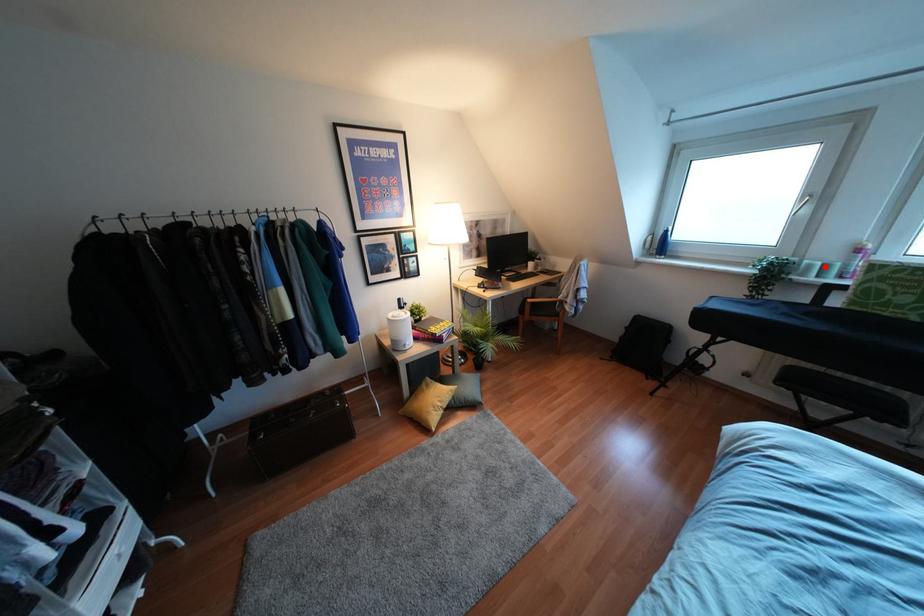
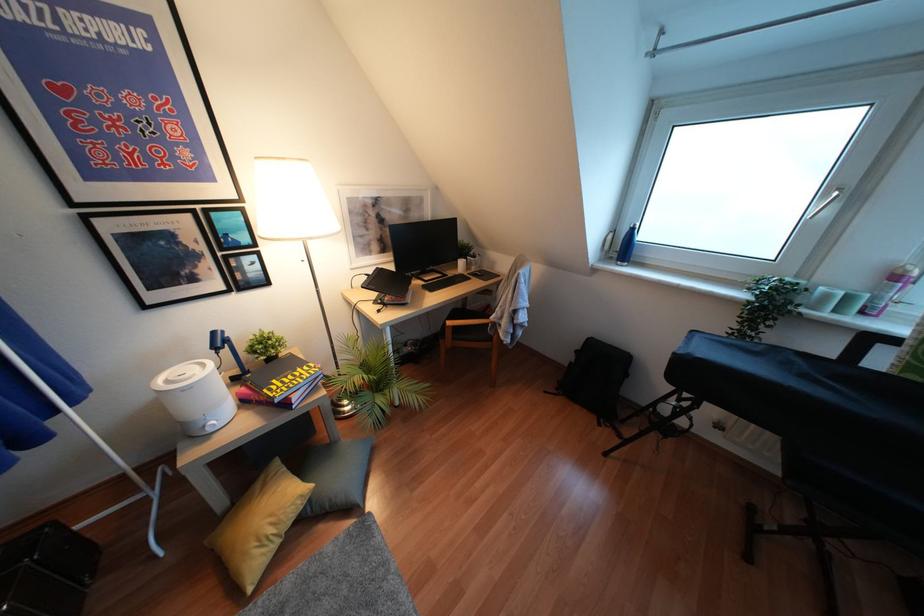
Where in the second image is the point corresponding to the highlighted location from the first image?

(846, 298)